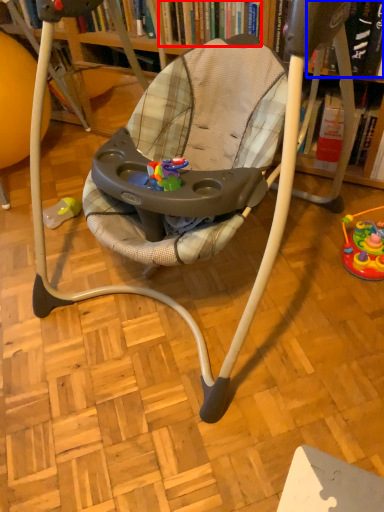
Question: Among these objects, which one is farthest to the camera, book (highlighted by a red box) or book (highlighted by a blue box)?

Choices:
 (A) book
 (B) book

Answer: (A)